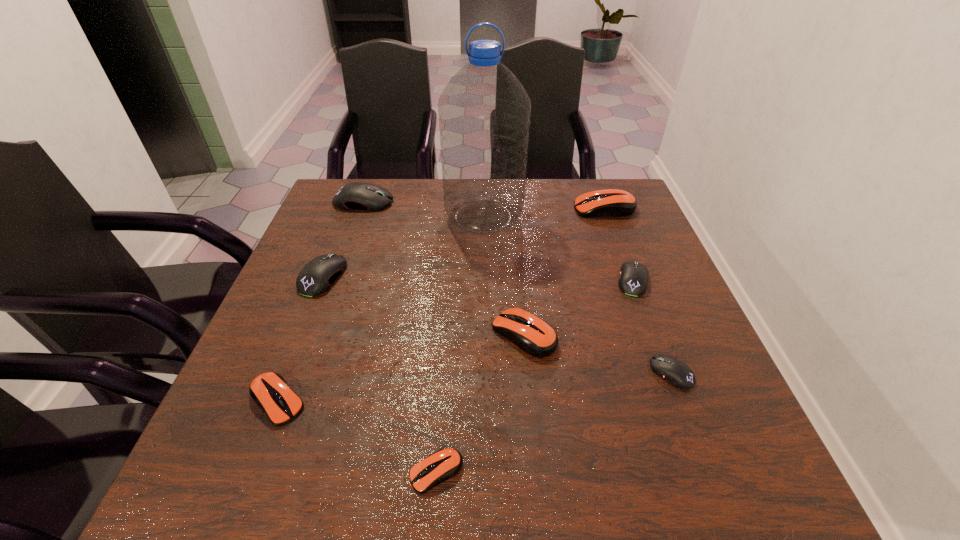
I want to click on the second nearest orange computer mouse, so click(270, 391).

Where is `the smallest black computer equipment`? the smallest black computer equipment is located at coordinates coord(677,373).

You are a GUI agent. You are given a task and a screenshot of the screen. Output one action in this format:
    pyautogui.click(x=<x>, y=<y>)
    Task: Click on the smallest orange computer mouse
    This screenshot has height=540, width=960.
    Given the screenshot: What is the action you would take?
    pyautogui.click(x=445, y=463)

The width and height of the screenshot is (960, 540). Identify the location of the nearest object. (445, 463).

Where is `vacant region located on the left of the water jug`? This screenshot has height=540, width=960. vacant region located on the left of the water jug is located at coordinates (323, 217).

Image resolution: width=960 pixels, height=540 pixels. I want to click on free region located on the front of the farthest black computer equipment, so click(354, 228).

Where is `vacant region located 0.170m on the front of the rightmost orange computer mouse`? The width and height of the screenshot is (960, 540). vacant region located 0.170m on the front of the rightmost orange computer mouse is located at coordinates (623, 255).

At what (x,y) coordinates should I click in order to perform the action: click on free region located 0.050m on the front of the third smallest black computer equipment. Please return your answer as a coordinate pair (x, y). Looking at the image, I should click on (308, 314).

Where is `free location located 0.310m on the back of the third orange computer mouse from left to right`? free location located 0.310m on the back of the third orange computer mouse from left to right is located at coordinates (514, 230).

Identify the location of vacant region located 0.330m on the back of the third biggest black computer equipment. (600, 194).